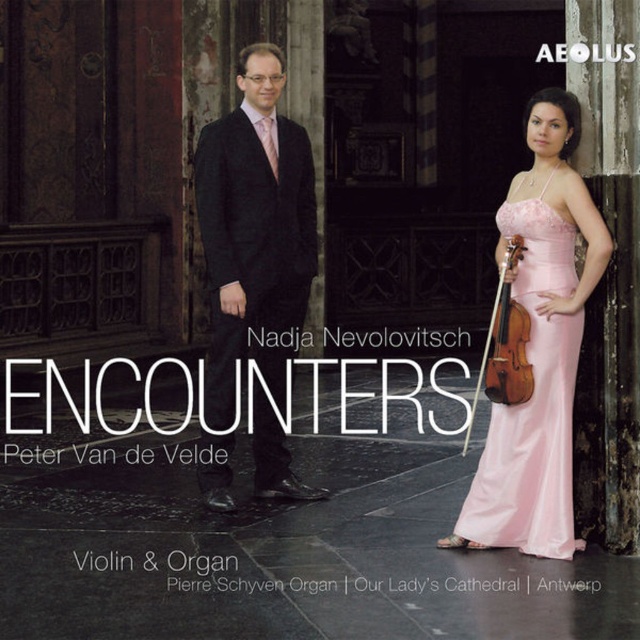
Does black wool suit at center appear on the right side of wooden violin at center?

No, black wool suit at center is not to the right of wooden violin at center.

Can you confirm if black wool suit at center is bigger than wooden violin at center?

Correct, black wool suit at center is larger in size than wooden violin at center.

Who is more forward, (268, 54) or (502, 388)?

Point (502, 388) is more forward.

Identify the location of black wool suit at center. The height and width of the screenshot is (640, 640). (253, 234).

Which is behind, point (278, 445) or point (528, 225)?

Positioned behind is point (278, 445).

Between point (305, 220) and point (536, 288), which one is positioned behind?

The point (305, 220) is more distant.

Image resolution: width=640 pixels, height=640 pixels. I want to click on black wool suit at center, so click(253, 234).

Does pink satin dress at right appear on the left side of wooden violin at center?

No, pink satin dress at right is not to the left of wooden violin at center.

Is point (483, 493) less distant than point (513, 378)?

No.

Identify the location of pink satin dress at right. The width and height of the screenshot is (640, 640). (536, 378).